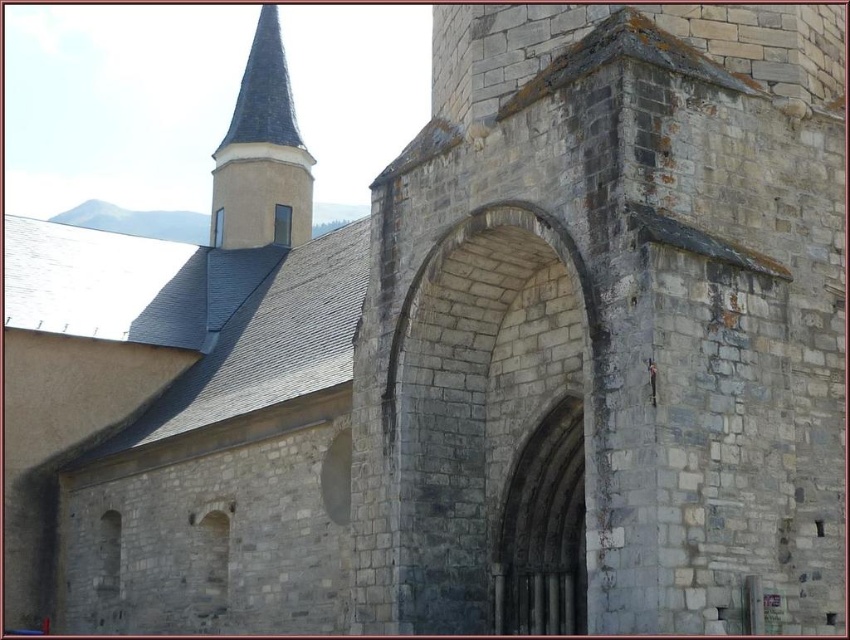
Question: Does gray stone archway at center have a smaller size compared to smooth gray stone spire at upper left?

Choices:
 (A) yes
 (B) no

Answer: (A)

Question: Among these objects, which one is farthest from the camera?

Choices:
 (A) smooth gray stone spire at upper left
 (B) gray stone archway at center

Answer: (A)

Question: Is gray stone archway at center below smooth gray stone spire at upper left?

Choices:
 (A) no
 (B) yes

Answer: (B)

Question: Is gray stone archway at center closer to the viewer compared to smooth gray stone spire at upper left?

Choices:
 (A) no
 (B) yes

Answer: (B)

Question: Among these objects, which one is nearest to the camera?

Choices:
 (A) gray stone archway at center
 (B) smooth gray stone spire at upper left

Answer: (A)